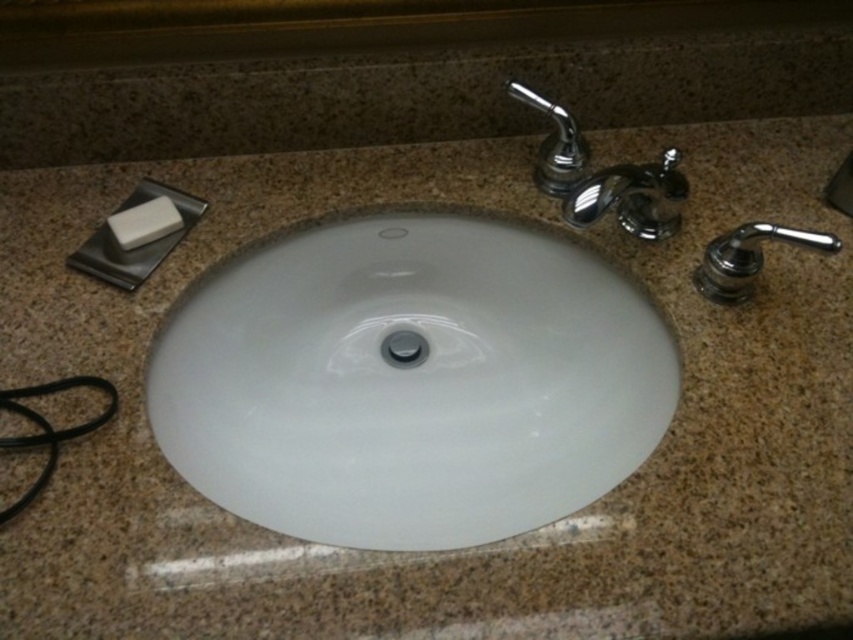
You are trying to determine which object in the bathroom sink area is taller between the polished chrome faucet at right and the white matte soap at upper left. Based on the scene description, which one is taller?

The polished chrome faucet at right is much taller than the white matte soap at upper left.

You are a maintenance worker checking the bathroom sink area. You need to reach a point that is exactly 70 centimeters away from your current position. Is the point at point coordinates point (698, 289) within your reach?

The distance of point (698, 289) from camera is 73.80 centimeters, so the point is 3.8 centimeters farther than the 70 centimeter target distance. Therefore, the point at point coordinates point (698, 289) is out of reach for the maintenance worker needing to reach exactly 70 centimeters.